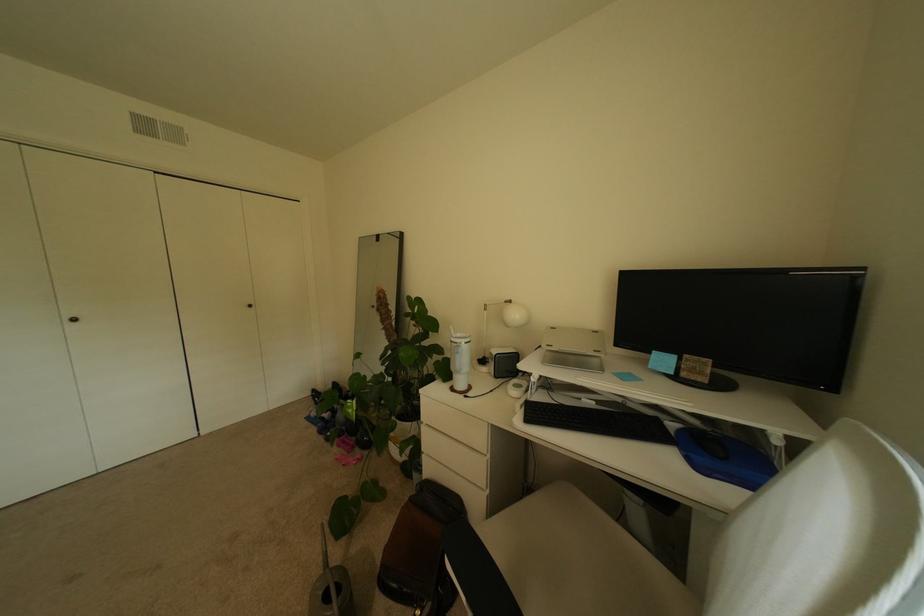
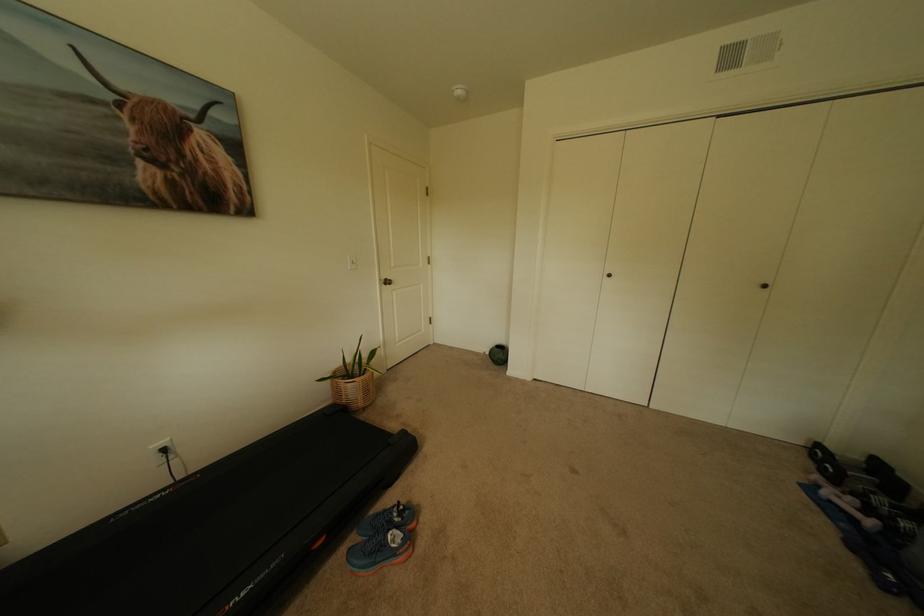
Locate, in the second image, the point that corresponds to point 332,419 in the first image.

(862, 521)